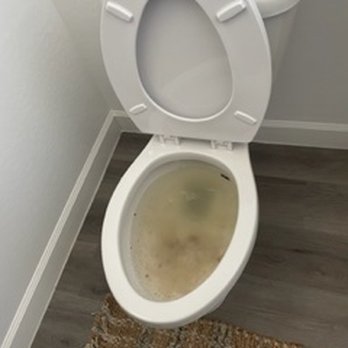
What are the coordinates of `toilet tank lid` in the screenshot? It's located at (270, 11).